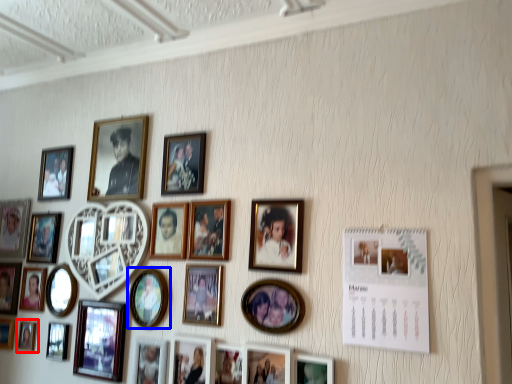
Question: Which of the following is the farthest to the observer, picture frame (highlighted by a red box) or picture frame (highlighted by a blue box)?

Choices:
 (A) picture frame
 (B) picture frame

Answer: (A)